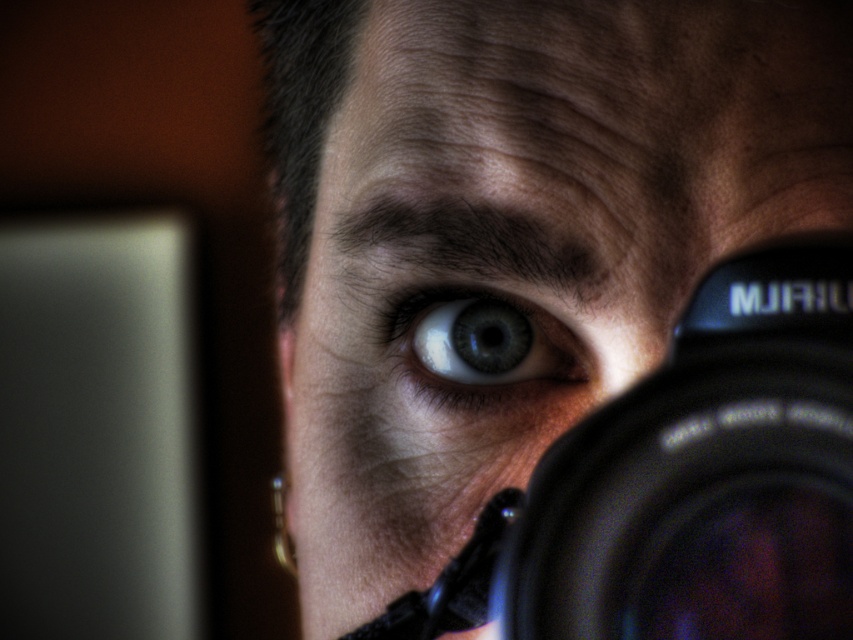
You are a photographer trying to capture a closeup of an eye. The subject has a matte black camera at center. You need to position the camera so that the distance between the camera and the subject is exactly 12 inches. Is the current distance sufficient?

The current distance between the matte black camera at center and the subject is 11.61 inches, which is slightly less than the required 12 inches. The photographer needs to move the matte black camera at center back by approximately 0.39 inches to achieve the desired distance.

You are a photographer trying to decide which camera to use for a portrait session. You have two cameras in front of you, the matte black camera at center and the black plastic camera at center. Which one is closer to your face?

The matte black camera at center is closer to your face because the black plastic camera at center is behind it.